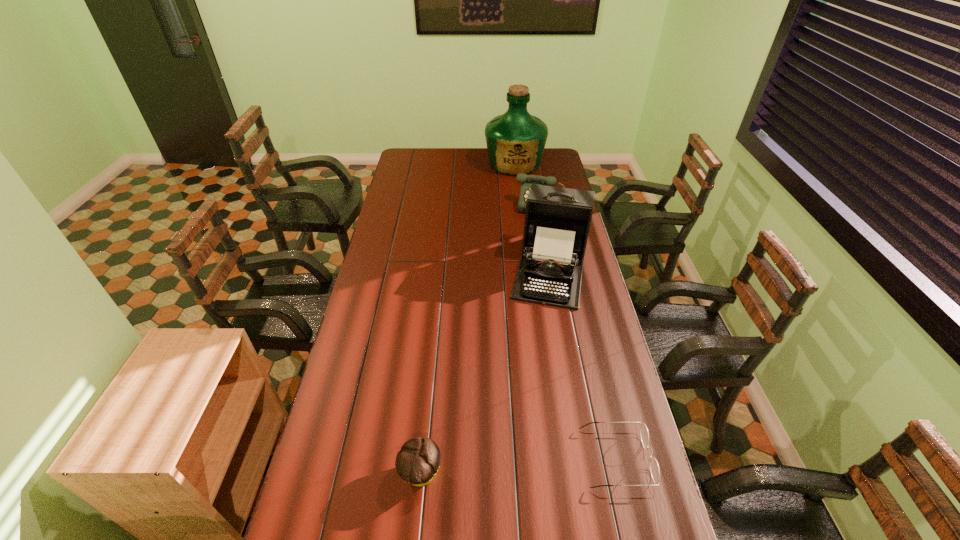
Find the location of a particular element. Image resolution: width=960 pixels, height=540 pixels. vacant space on the desktop that is between the leftmost object and the spectacles and is positioned inside the open case of the typewriter is located at coordinates (515, 466).

At what (x,y) coordinates should I click in order to perform the action: click on free spot on the desktop that is between the muffin and the shortest object and is positioned on the dial of the telephone. Please return your answer as a coordinate pair (x, y). The height and width of the screenshot is (540, 960). Looking at the image, I should click on (495, 468).

Where is `vacant space on the desktop that is between the fourth tallest object and the spectacles and is positioned on the label side of the liquor`? vacant space on the desktop that is between the fourth tallest object and the spectacles and is positioned on the label side of the liquor is located at coordinates (495, 468).